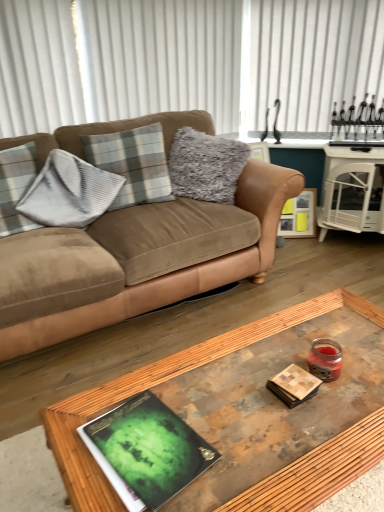
You are a GUI agent. You are given a task and a screenshot of the screen. Output one action in this format:
    pyautogui.click(x=<x>, y=<y>)
    Task: Click on the vacant space situated above green matte book at center (from a real-world perspective)
    
    Given the screenshot: What is the action you would take?
    pyautogui.click(x=148, y=439)